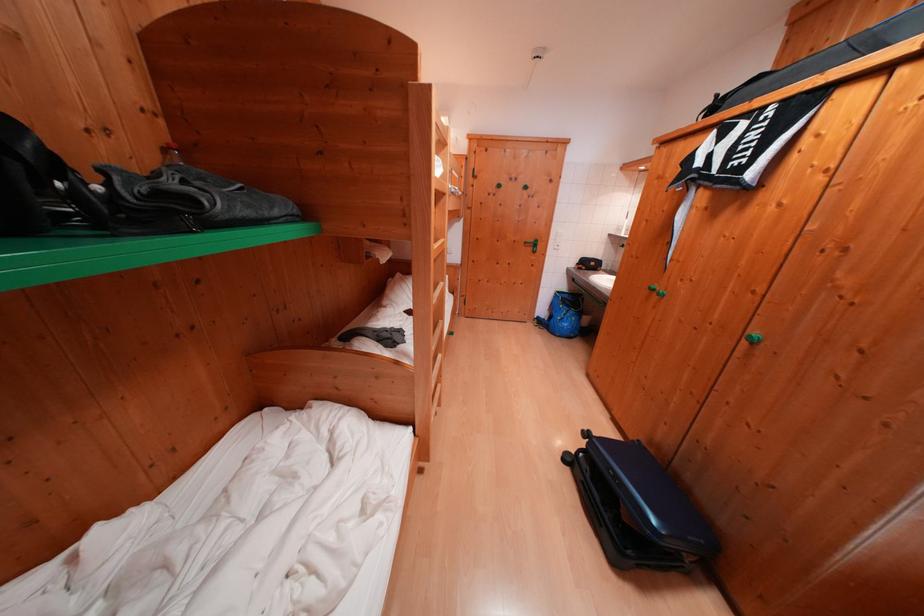
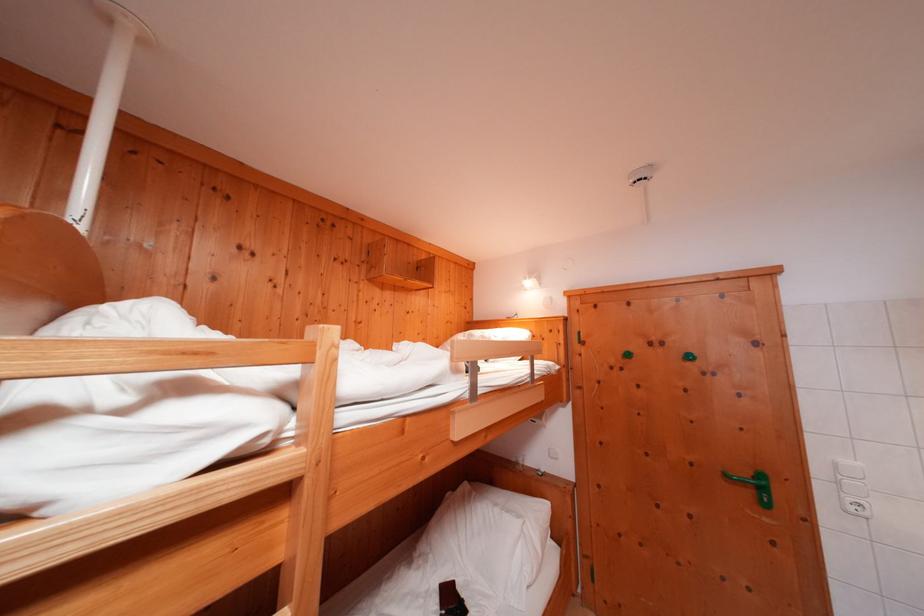
Locate, in the second image, the point that corresponds to point (543, 249) in the first image.

(771, 493)